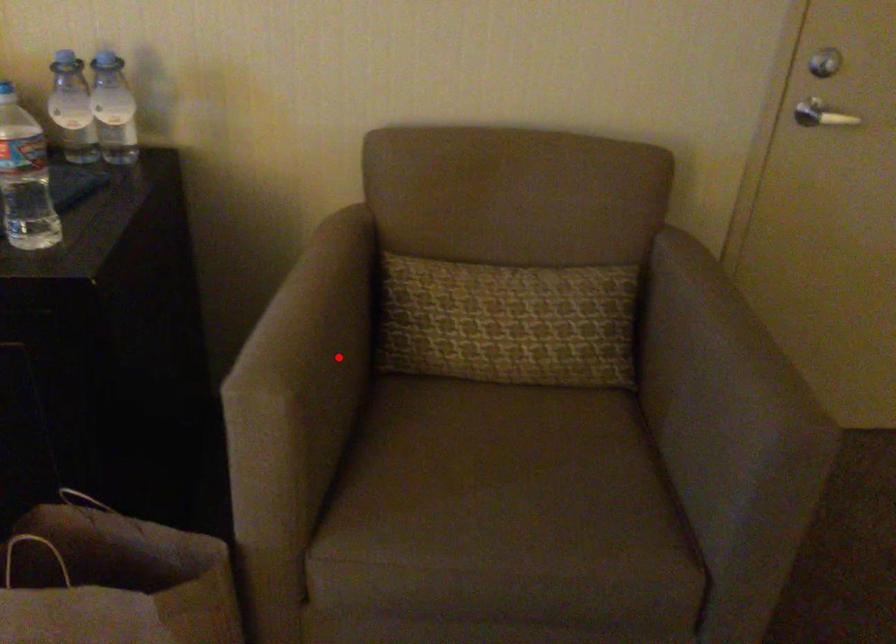
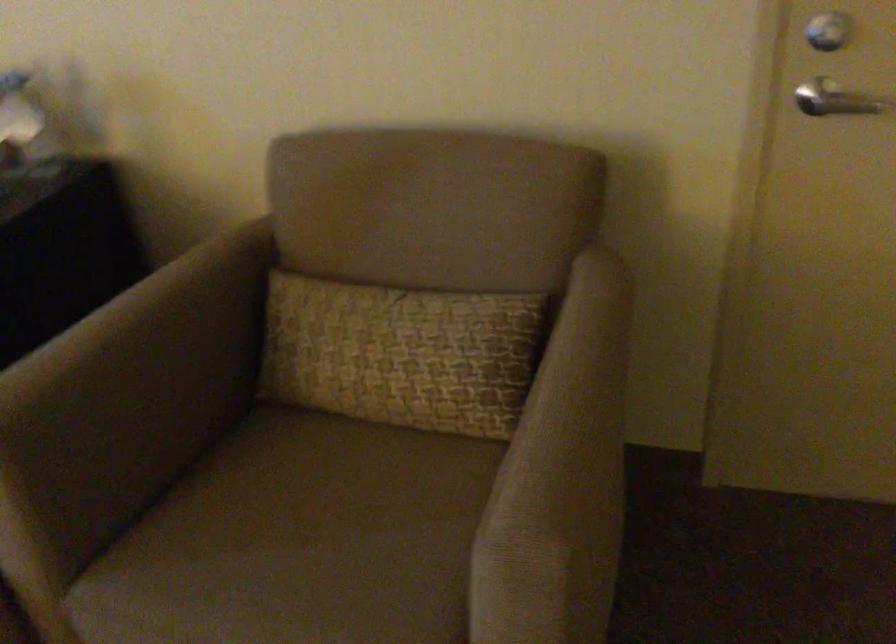
Find the pixel in the second image that matches the highlighted location in the first image.

(135, 389)